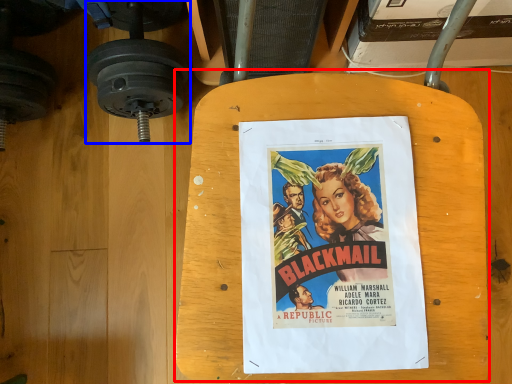
Question: Which object is further to the camera taking this photo, table (highlighted by a red box) or dumbbell (highlighted by a blue box)?

Choices:
 (A) table
 (B) dumbbell

Answer: (B)